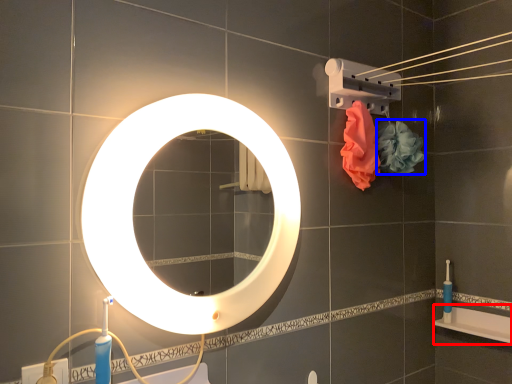
Question: Which object appears farthest to the camera in this image, bath (highlighted by a red box) or flower (highlighted by a blue box)?

Choices:
 (A) bath
 (B) flower

Answer: (A)